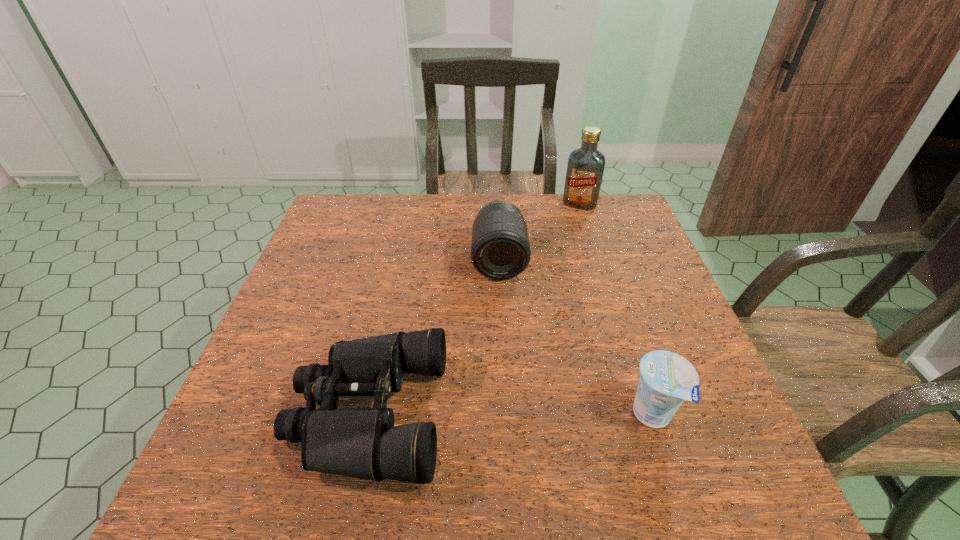
Find the location of a particular element. This screenshot has height=540, width=960. vodka located in the right edge section of the desktop is located at coordinates (585, 168).

Locate an element on the screen. object present at the near left corner is located at coordinates (x=363, y=443).

This screenshot has width=960, height=540. Identify the location of object that is positioned at the far right corner. (585, 168).

Locate an element on the screen. object at the near right corner is located at coordinates tap(667, 379).

The width and height of the screenshot is (960, 540). I want to click on free space at the far edge of the desktop, so click(x=482, y=198).

Image resolution: width=960 pixels, height=540 pixels. Identify the location of vacant space at the near edge of the desktop. (529, 441).

The image size is (960, 540). In the image, there is a desktop. What are the coordinates of `free space at the left edge` in the screenshot? It's located at (321, 245).

Where is `vacant space at the right edge of the desktop`? vacant space at the right edge of the desktop is located at coordinates (669, 322).

Find the location of a particular element. The width and height of the screenshot is (960, 540). vacant space at the far left corner of the desktop is located at coordinates (370, 202).

Where is `free region at the far right corner`? free region at the far right corner is located at coordinates (601, 198).